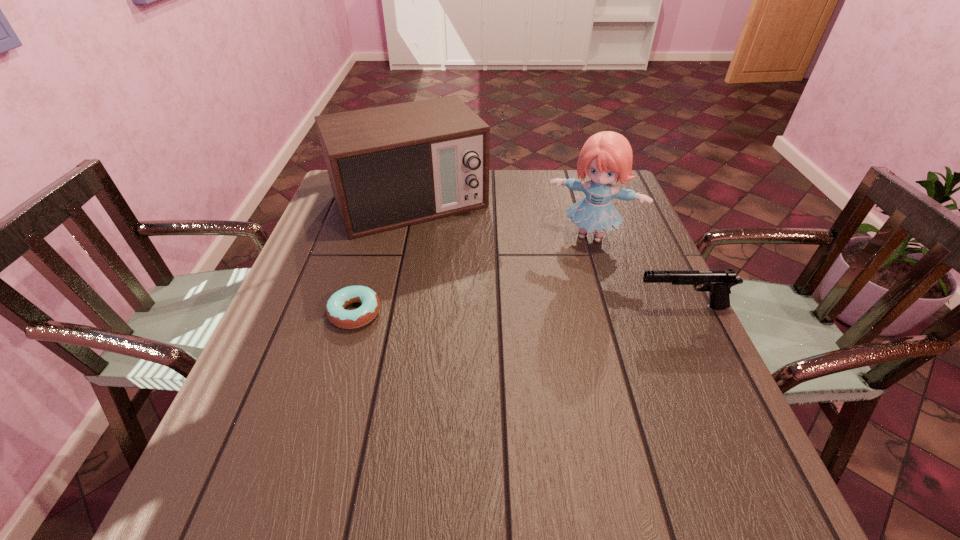
Locate an element on the screen. The image size is (960, 540). vacant space on the desktop that is between the shortest object and the third tallest object and is positioned on the front-facing side of the tallest object is located at coordinates (564, 309).

Image resolution: width=960 pixels, height=540 pixels. What are the coordinates of `vacant space on the desktop that is between the shortest object and the gun and is positioned on the front-facing side of the radio receiver` in the screenshot? It's located at (472, 311).